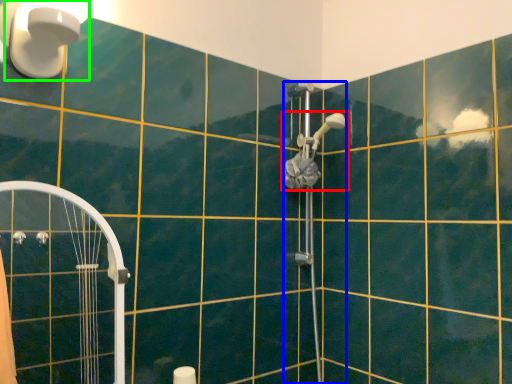
Question: Based on their relative distances, which object is farther from shower (highlighted by a red box)? Choose from shower (highlighted by a blue box) and light fixture (highlighted by a green box).

Choices:
 (A) shower
 (B) light fixture

Answer: (B)